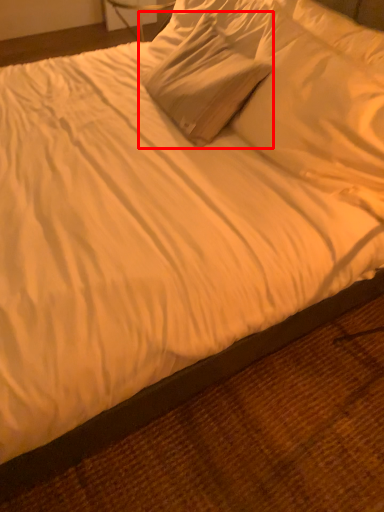
Question: Where is pillow (annotated by the red box) located in relation to pillow in the image?

Choices:
 (A) left
 (B) right

Answer: (A)